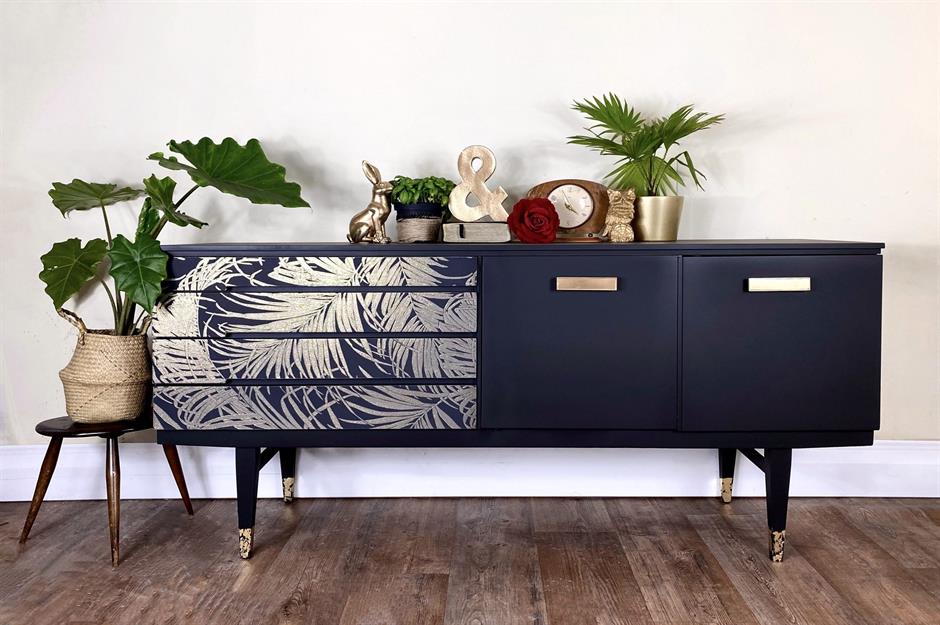
I want to click on book, so click(x=491, y=232).